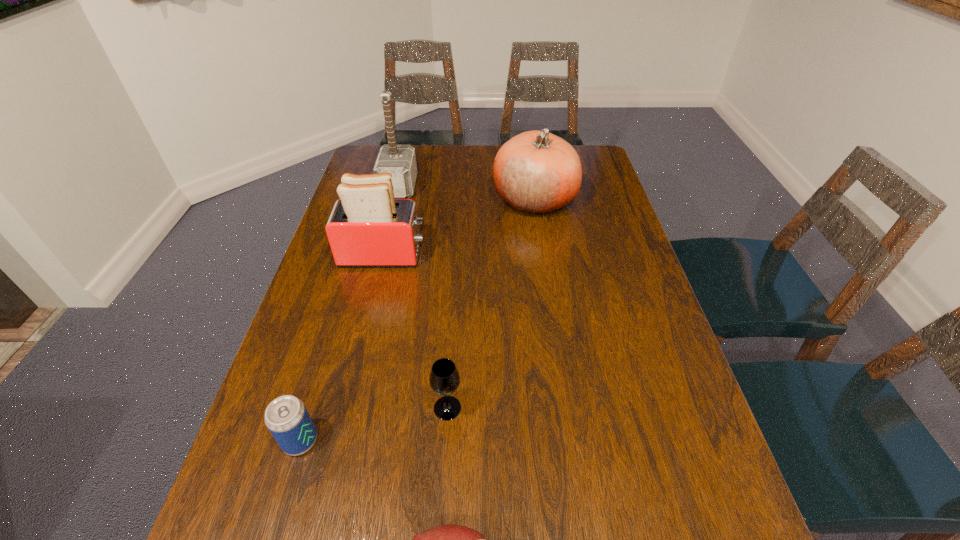
Identify the location of vacant space located 0.260m on the back of the third shortest object. The width and height of the screenshot is (960, 540). (453, 305).

This screenshot has width=960, height=540. In order to click on free space located on the back of the fifth farthest object in this screenshot , I will do `click(348, 284)`.

Identify the location of hammer present at the far edge. The width and height of the screenshot is (960, 540). click(398, 159).

Where is `pumpkin that is at the far edge`? Image resolution: width=960 pixels, height=540 pixels. pumpkin that is at the far edge is located at coordinates (536, 172).

Find the location of a particular element. The width and height of the screenshot is (960, 540). hammer present at the left edge is located at coordinates (398, 159).

I want to click on toaster that is positioned at the left edge, so pos(367,227).

Locate an element on the screen. beer can that is at the left edge is located at coordinates (286, 417).

This screenshot has height=540, width=960. I want to click on object at the right edge, so click(x=536, y=172).

Identify the location of object at the far left corner. (398, 159).

I want to click on object that is at the far right corner, so click(x=536, y=172).